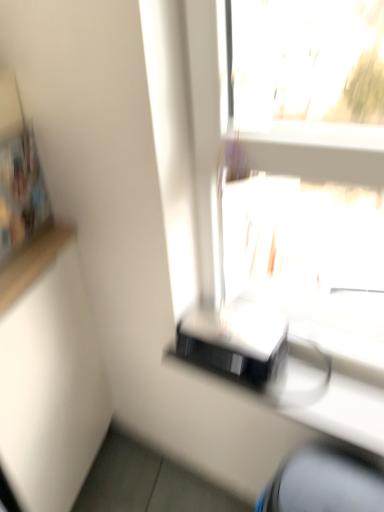
Where is `empty space that is ontop of black glossy printer at lower right (from a real-world perspective)`? Image resolution: width=384 pixels, height=512 pixels. empty space that is ontop of black glossy printer at lower right (from a real-world perspective) is located at coordinates (292, 382).